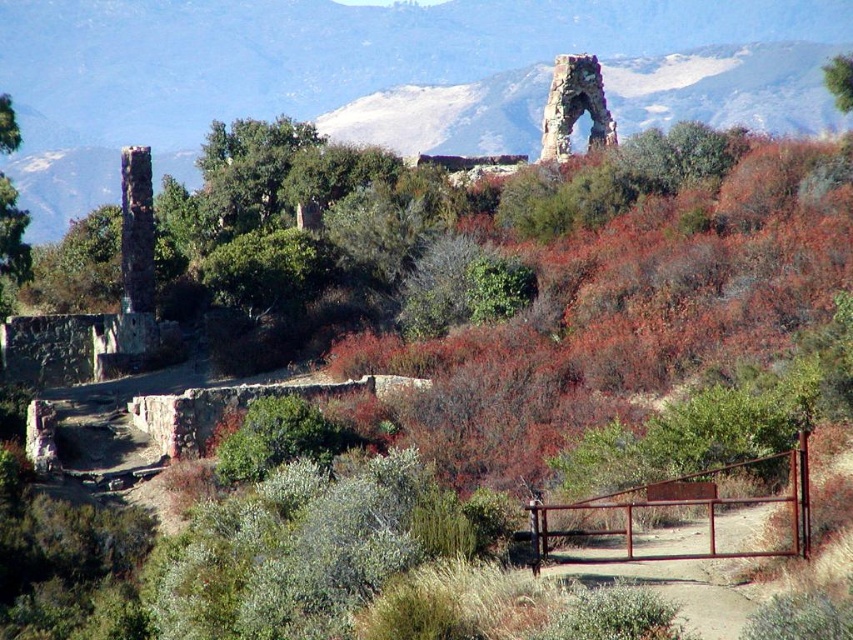
Question: Observing the image, what is the correct spatial positioning of rusty metal gate at lower right in reference to rusty stone arch at upper center?

Choices:
 (A) above
 (B) below

Answer: (B)

Question: Is rusty metal gate at lower right to the left of rusty stone arch at upper center from the viewer's perspective?

Choices:
 (A) yes
 (B) no

Answer: (A)

Question: Does rusty metal gate at lower right appear over rusty stone arch at upper center?

Choices:
 (A) no
 (B) yes

Answer: (A)